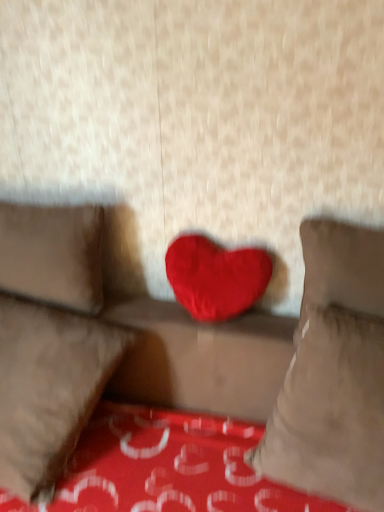
Where is `vacant region above suede-like beige pillow at left, the first pillow in the left-to-right sequence (from a real-world perspective)`? vacant region above suede-like beige pillow at left, the first pillow in the left-to-right sequence (from a real-world perspective) is located at coordinates (38, 204).